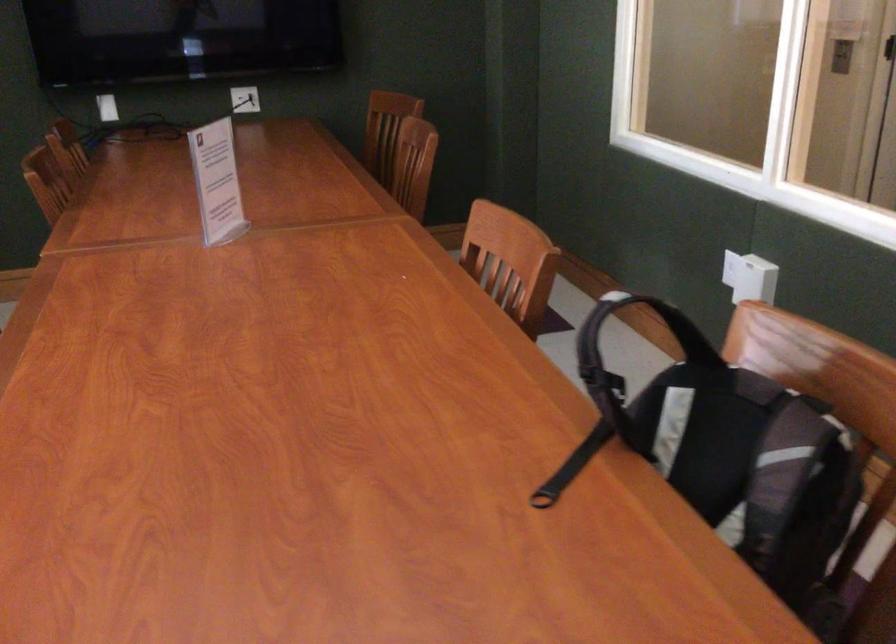
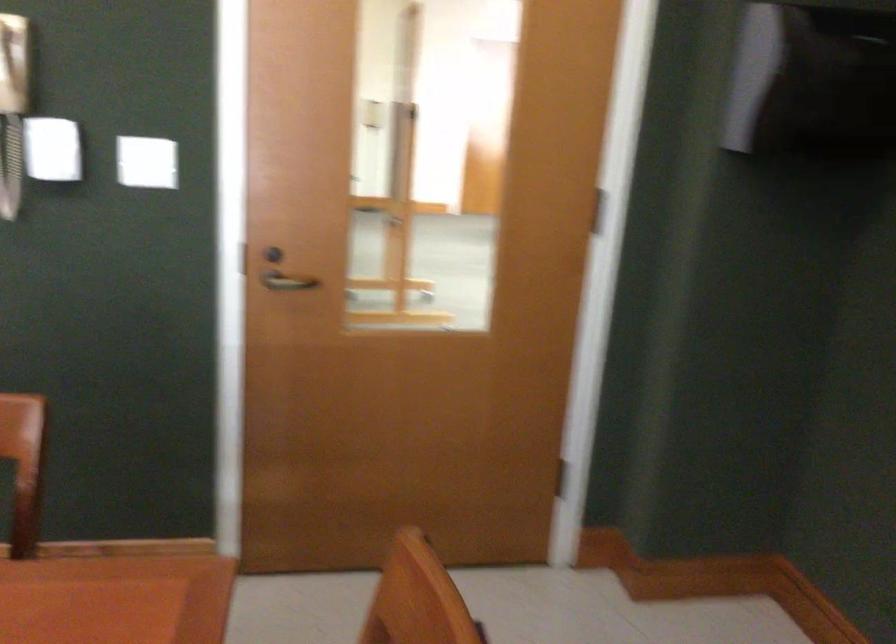
Question: The camera is either moving clockwise (left) or counter-clockwise (right) around the object. The first image is from the beginning of the video and the second image is from the end. Is the camera moving left or right when shooting the video?

Choices:
 (A) Left
 (B) Right

Answer: (A)